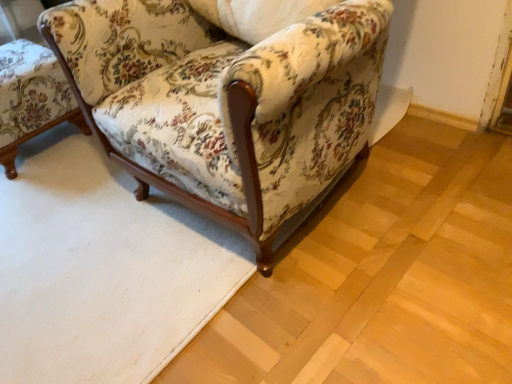
Question: From a real-world perspective, is floral fabric chair at center, acting as the 2th chair starting from the left, beneath wooden armchair at left, which is counted as the second chair, starting from the right?

Choices:
 (A) yes
 (B) no

Answer: (B)

Question: From the image's perspective, is floral fabric chair at center, which is the first chair in right-to-left order, on top of wooden armchair at left, the first chair from the left?

Choices:
 (A) no
 (B) yes

Answer: (A)

Question: Can you confirm if floral fabric chair at center, which is the first chair in right-to-left order, is wider than wooden armchair at left, the first chair from the left?

Choices:
 (A) no
 (B) yes

Answer: (B)

Question: Does floral fabric chair at center, acting as the 2th chair starting from the left, have a smaller size compared to wooden armchair at left, which is counted as the second chair, starting from the right?

Choices:
 (A) yes
 (B) no

Answer: (B)

Question: Could you tell me if floral fabric chair at center, which is the first chair in right-to-left order, is turned towards wooden armchair at left, which is counted as the second chair, starting from the right?

Choices:
 (A) no
 (B) yes

Answer: (A)

Question: Does floral fabric chair at center, acting as the 2th chair starting from the left, lie in front of wooden armchair at left, which is counted as the second chair, starting from the right?

Choices:
 (A) no
 (B) yes

Answer: (B)

Question: Is wooden armchair at left, which is counted as the second chair, starting from the right, next to floral fabric chair at center, which is the first chair in right-to-left order?

Choices:
 (A) yes
 (B) no

Answer: (B)

Question: Is there a large distance between wooden armchair at left, which is counted as the second chair, starting from the right, and floral fabric chair at center, which is the first chair in right-to-left order?

Choices:
 (A) yes
 (B) no

Answer: (B)

Question: Considering the relative sizes of wooden armchair at left, which is counted as the second chair, starting from the right, and floral fabric chair at center, which is the first chair in right-to-left order, in the image provided, is wooden armchair at left, which is counted as the second chair, starting from the right, thinner than floral fabric chair at center, which is the first chair in right-to-left order,?

Choices:
 (A) yes
 (B) no

Answer: (A)

Question: From the image's perspective, is wooden armchair at left, which is counted as the second chair, starting from the right, located beneath floral fabric chair at center, acting as the 2th chair starting from the left?

Choices:
 (A) no
 (B) yes

Answer: (A)

Question: Does wooden armchair at left, the first chair from the left, have a greater width compared to floral fabric chair at center, acting as the 2th chair starting from the left?

Choices:
 (A) yes
 (B) no

Answer: (B)

Question: Can you confirm if wooden armchair at left, the first chair from the left, is taller than floral fabric chair at center, which is the first chair in right-to-left order?

Choices:
 (A) no
 (B) yes

Answer: (A)

Question: Considering the positions of wooden armchair at left, the first chair from the left, and floral fabric chair at center, which is the first chair in right-to-left order, in the image, is wooden armchair at left, the first chair from the left, wider or thinner than floral fabric chair at center, which is the first chair in right-to-left order,?

Choices:
 (A) thin
 (B) wide

Answer: (A)